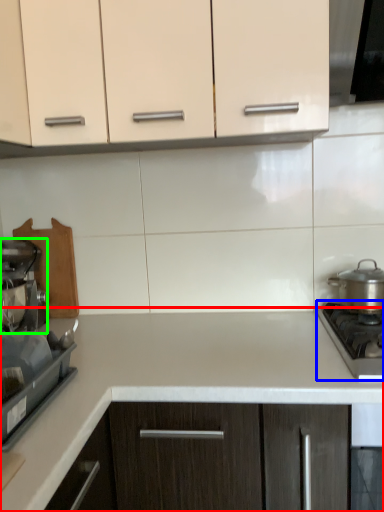
Question: Considering the real-world distances, which object is farthest from countertop (highlighted by a red box)? gas stove (highlighted by a blue box) or kitchen appliance (highlighted by a green box)?

Choices:
 (A) gas stove
 (B) kitchen appliance

Answer: (B)